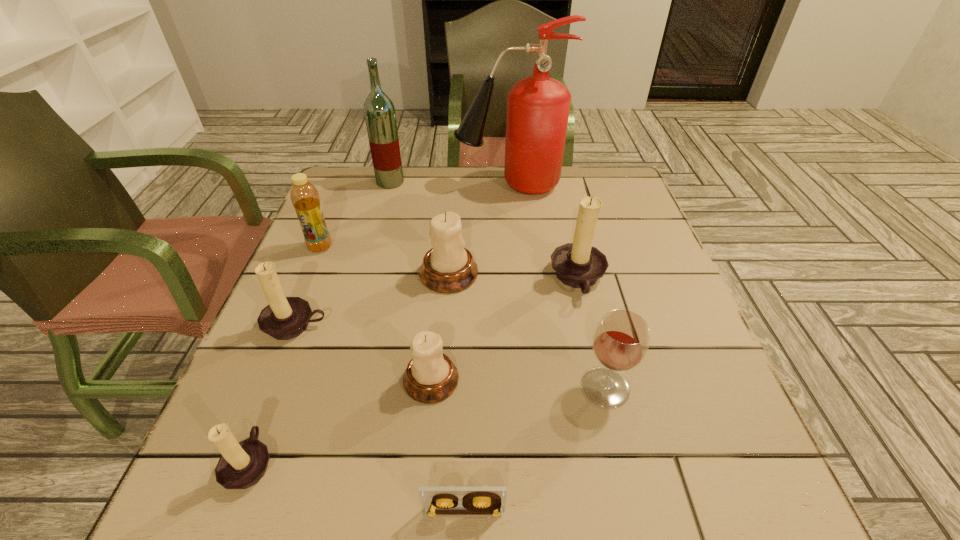
This screenshot has width=960, height=540. What are the coordinates of `free space between the smaller white candle holder and the nearest object` in the screenshot? It's located at (447, 446).

You are a GUI agent. You are given a task and a screenshot of the screen. Output one action in this format:
    pyautogui.click(x=<x>, y=<y>)
    Task: Click on the free point between the nearest brown candle holder and the bigger white candle holder
    This screenshot has width=960, height=540.
    Given the screenshot: What is the action you would take?
    pyautogui.click(x=349, y=368)

I want to click on vacant point located between the red fire extinguisher and the videotape, so click(487, 348).

Identify the location of empty location between the nearer white candle holder and the ninth shortest object. Image resolution: width=960 pixels, height=540 pixels. (411, 281).

Where is `free spot between the wineglass and the brown videotape`? free spot between the wineglass and the brown videotape is located at coordinates (535, 450).

At what (x,y) coordinates should I click in order to perform the action: click on free space between the bigger white candle holder and the farthest brown candle holder. Please return your answer as a coordinate pair (x, y). This screenshot has height=540, width=960. Looking at the image, I should click on (514, 276).

Identify the location of object identified as the closest to the red wineglass. (579, 265).

Locate an element on the screen. object that is the sixth closest to the fire extinguisher is located at coordinates (430, 377).

Choose which candle holder is the nearest neighbor to the shortest object. Please provide its 2D coordinates. Your answer should be formatted as a tuple, i.e. [(x, y)], where the tuple contains the x and y coordinates of a point satisfying the conditions above.

[(430, 377)]

This screenshot has width=960, height=540. I want to click on candle holder that is the fourth closest to the tallest object, so click(430, 377).